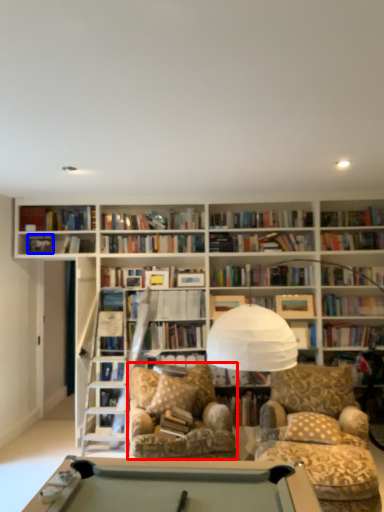
Question: Which object is further to the camera taking this photo, swivel chair (highlighted by a red box) or paperback book (highlighted by a blue box)?

Choices:
 (A) swivel chair
 (B) paperback book

Answer: (B)